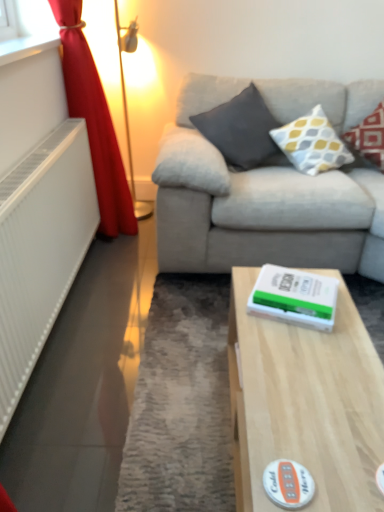
Find the location of `vacant space situated on the left part of light wood table at center`. vacant space situated on the left part of light wood table at center is located at coordinates (182, 428).